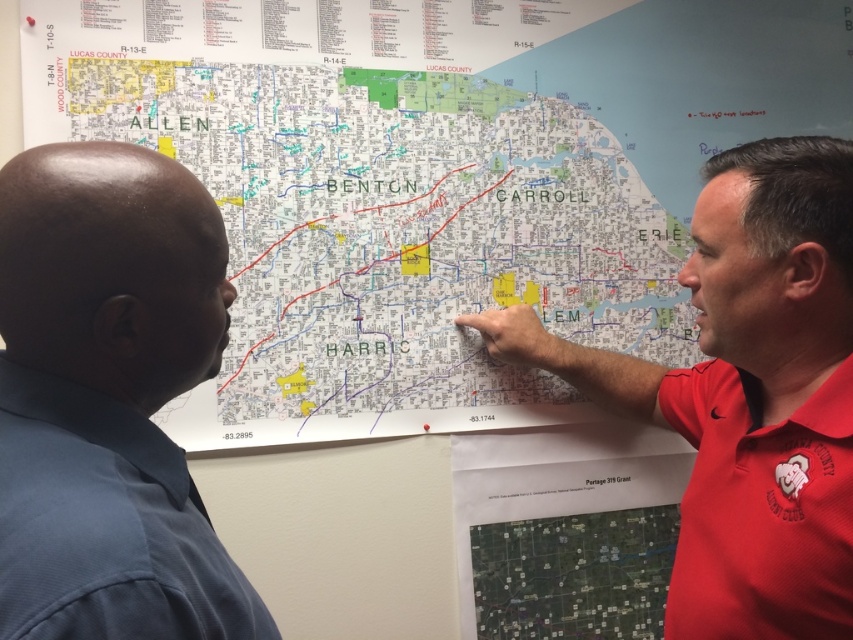
Which is more to the right, red shirt at upper right or red cotton polo shirt at right?

red cotton polo shirt at right is more to the right.

Which is below, red shirt at upper right or red cotton polo shirt at right?

red cotton polo shirt at right is lower down.

Between point (666, 636) and point (822, 580), which one is positioned behind?

Point (666, 636)

Where is `red shirt at upper right`? Image resolution: width=853 pixels, height=640 pixels. red shirt at upper right is located at coordinates (747, 394).

Is white paper map at upper center above red cotton polo shirt at right?

Yes.

Can you confirm if white paper map at upper center is positioned to the left of red cotton polo shirt at right?

Indeed, white paper map at upper center is positioned on the left side of red cotton polo shirt at right.

Who is more forward, (428, 342) or (822, 381)?

Point (822, 381) is in front.

Where is `white paper map at upper center`? The image size is (853, 640). white paper map at upper center is located at coordinates (432, 179).

Between white paper map at upper center and red shirt at upper right, which one appears on the right side from the viewer's perspective?

red shirt at upper right

Looking at this image, is white paper map at upper center to the right of red shirt at upper right from the viewer's perspective?

Incorrect, white paper map at upper center is not on the right side of red shirt at upper right.

Describe the element at coordinates (432, 179) in the screenshot. The width and height of the screenshot is (853, 640). I see `white paper map at upper center` at that location.

Where is `white paper map at upper center`? The height and width of the screenshot is (640, 853). white paper map at upper center is located at coordinates (432, 179).